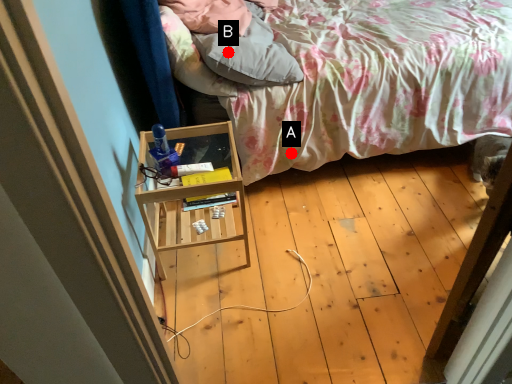
Question: Two points are circled on the image, labeled by A and B beside each circle. Which of the following is the farthest from the observer?

Choices:
 (A) A is further
 (B) B is further

Answer: (A)